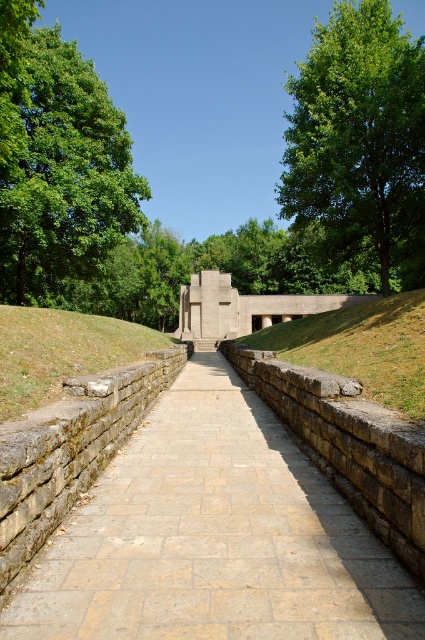
Can you confirm if stone paved path at center is thinner than green leafy tree at upper right?

Indeed, stone paved path at center has a lesser width compared to green leafy tree at upper right.

Does stone paved path at center lie behind green leafy tree at upper right?

No, stone paved path at center is closer to the viewer.

Which is in front, point (124, 616) or point (325, 67)?

Point (124, 616) is more forward.

The height and width of the screenshot is (640, 425). Find the location of `stone paved path at center`. stone paved path at center is located at coordinates (212, 538).

What do you see at coordinates (359, 141) in the screenshot? This screenshot has width=425, height=640. I see `green leafy tree at upper right` at bounding box center [359, 141].

Is green leafy tree at upper right smaller than brown stone wall at lower left?

Incorrect, green leafy tree at upper right is not smaller in size than brown stone wall at lower left.

Which is in front, point (328, 256) or point (45, 316)?

Positioned in front is point (45, 316).

At what (x,y) coordinates should I click in order to perform the action: click on green leafy tree at upper right. Please return your answer as a coordinate pair (x, y). This screenshot has height=640, width=425. Looking at the image, I should click on (359, 141).

Is stone paved path at center to the right of green leafy tree at left from the viewer's perspective?

Indeed, stone paved path at center is positioned on the right side of green leafy tree at left.

Where is `stone paved path at center`? The width and height of the screenshot is (425, 640). stone paved path at center is located at coordinates (212, 538).